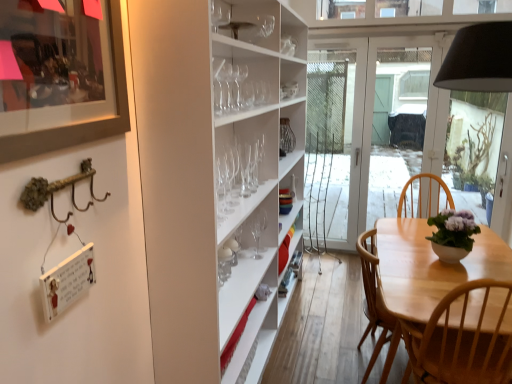
Question: In terms of height, does transparent glass wine glass at upper center, which is the first wine glass from front to back, look taller or shorter compared to clear glass wine glass at center, the 5th wine glass positioned from the back?

Choices:
 (A) tall
 (B) short

Answer: (B)

Question: From a real-world perspective, is transparent glass wine glass at upper center, the sixth wine glass viewed from the back, above or below clear glass wine glass at center, the 5th wine glass positioned from the back?

Choices:
 (A) above
 (B) below

Answer: (A)

Question: Estimate the real-world distances between objects in this image. Which object is closer to the matte black picture frame at upper left?

Choices:
 (A) light wood chair at lower right
 (B) clear glass wine glass at center, the 5th wine glass positioned from the back
 (C) clear glass wine glass at center, the second wine glass viewed from the back
 (D) clear glass wine glass at center, placed as the third wine glass when sorted from back to front
 (E) transparent glass wine glass at upper center, the sixth wine glass viewed from the back

Answer: (E)

Question: Which object is the closest to the clear glass wine glass at center, arranged as the fourth wine glass when viewed from the back?

Choices:
 (A) transparent glass wine glass at upper center, which is the first wine glass from front to back
 (B) light wood chair at lower right
 (C) white glass door at center
 (D) clear glass wine glass at center, the 1th wine glass positioned from the back
 (E) clear glass wine glass at center, the 5th wine glass positioned from the back

Answer: (E)